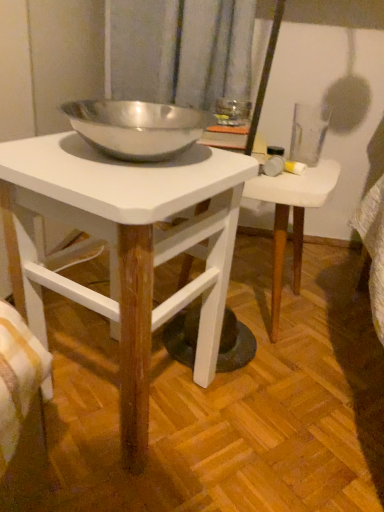
Identify the location of vacant area situated below white wood table at center, which is the first table in back-to-front order (from a real-world perspective). (258, 310).